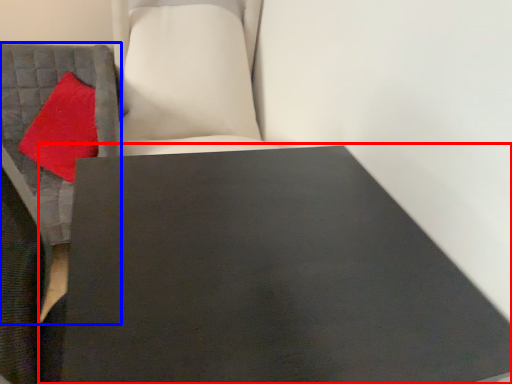
Question: Which object is closer to the camera taking this photo, table (highlighted by a red box) or furniture (highlighted by a blue box)?

Choices:
 (A) table
 (B) furniture

Answer: (A)